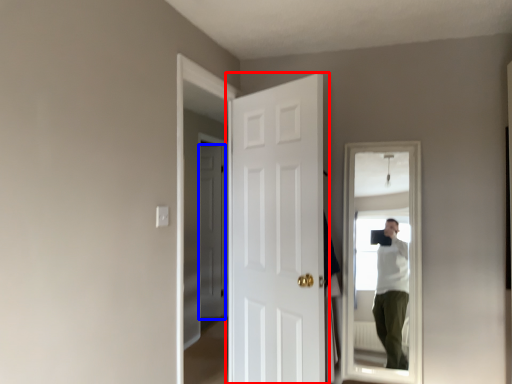
Question: Which object appears closest to the camera in this image, door (highlighted by a red box) or door (highlighted by a blue box)?

Choices:
 (A) door
 (B) door

Answer: (A)